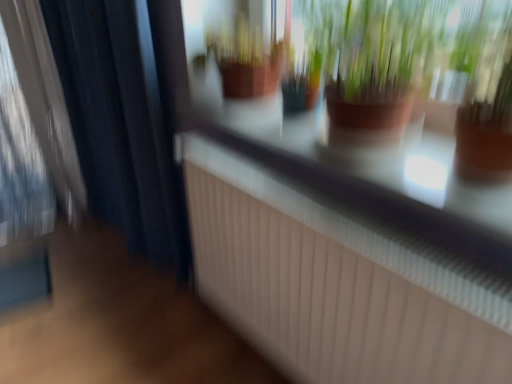
Question: From a real-world perspective, relative to dark blue fabric curtain at left, is brown clay pot at upper center vertically above or below?

Choices:
 (A) below
 (B) above

Answer: (B)

Question: From the image's perspective, is brown clay pot at upper center above or below dark blue fabric curtain at left?

Choices:
 (A) below
 (B) above

Answer: (A)

Question: From their relative heights in the image, would you say brown clay pot at upper center is taller or shorter than dark blue fabric curtain at left?

Choices:
 (A) tall
 (B) short

Answer: (B)

Question: From the image's perspective, relative to brown clay pot at upper center, is dark blue fabric curtain at left above or below?

Choices:
 (A) above
 (B) below

Answer: (A)

Question: Would you say dark blue fabric curtain at left is to the left or to the right of brown clay pot at upper center in the picture?

Choices:
 (A) right
 (B) left

Answer: (B)

Question: In terms of size, does dark blue fabric curtain at left appear bigger or smaller than brown clay pot at upper center?

Choices:
 (A) big
 (B) small

Answer: (A)

Question: From a real-world perspective, is dark blue fabric curtain at left above or below brown clay pot at upper center?

Choices:
 (A) above
 (B) below

Answer: (B)